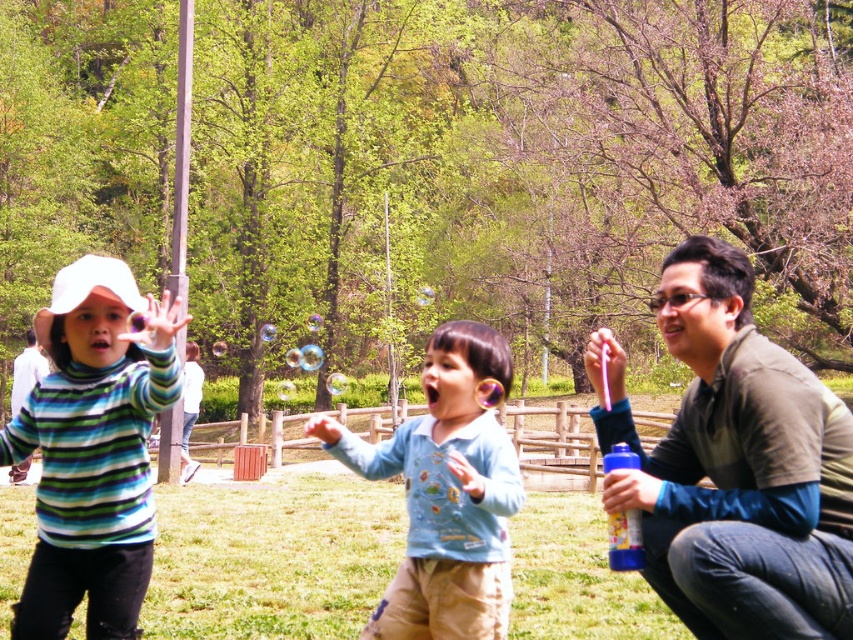
Question: Can you confirm if white matte hat at left is smaller than blue cotton shirt at center?

Choices:
 (A) yes
 (B) no

Answer: (B)

Question: Which object appears closest to the camera in this image?

Choices:
 (A) matte brown shirt at lower right
 (B) green grass at center

Answer: (A)

Question: Is matte brown shirt at lower right smaller than blue cotton shirt at center?

Choices:
 (A) no
 (B) yes

Answer: (A)

Question: Does matte brown shirt at lower right come behind white matte hat at left?

Choices:
 (A) no
 (B) yes

Answer: (B)

Question: Which point is closer to the camera?

Choices:
 (A) (165, 604)
 (B) (773, 636)
 (C) (79, 550)
 (D) (427, 596)

Answer: (B)

Question: Which object is farther from the camera taking this photo?

Choices:
 (A) blue cotton shirt at center
 (B) white matte hat at left

Answer: (A)